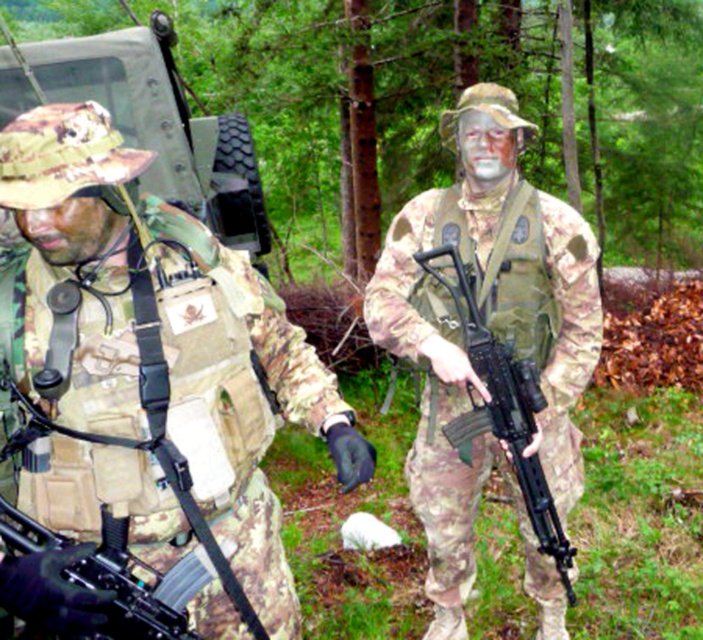
Question: Which point is closer to the camera taking this photo?

Choices:
 (A) (64, 449)
 (B) (583, 300)

Answer: (A)

Question: Which point appears farthest from the camera in this image?

Choices:
 (A) (98, 145)
 (B) (531, 566)

Answer: (B)

Question: Is camouflage fabric uniform at center closer to the viewer compared to camo fabric uniform at center?

Choices:
 (A) no
 (B) yes

Answer: (B)

Question: Is camouflage fabric uniform at center positioned in front of camo fabric uniform at center?

Choices:
 (A) yes
 (B) no

Answer: (A)

Question: Does camouflage fabric uniform at center have a smaller size compared to camo fabric uniform at center?

Choices:
 (A) no
 (B) yes

Answer: (B)